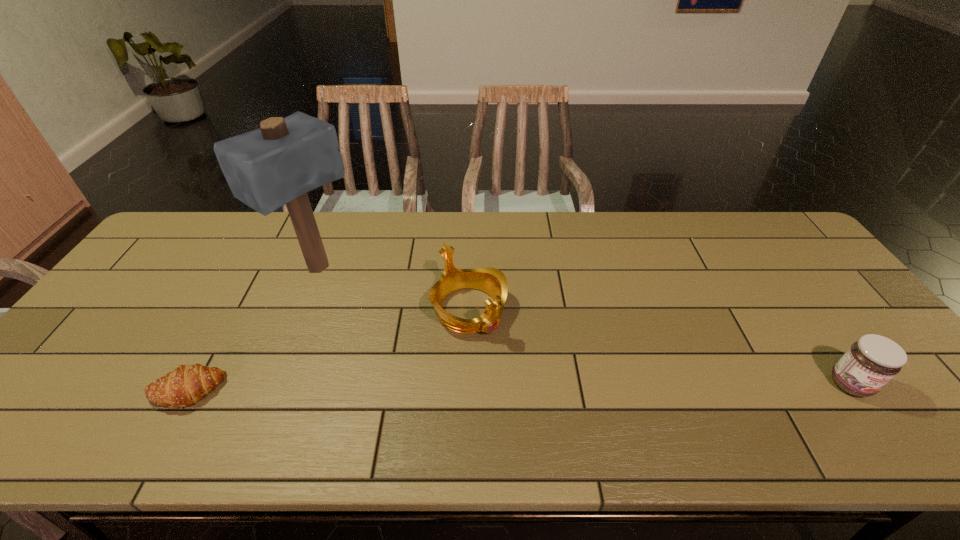
Image resolution: width=960 pixels, height=540 pixels. Identify the location of free space between the jam and the tiara. (660, 347).

I want to click on vacant space that is in between the mallet and the tiara, so click(394, 289).

At what (x,y) coordinates should I click in order to perform the action: click on free space between the second object from right to left and the crescent roll. Please return your answer as a coordinate pair (x, y). The image size is (960, 540). Looking at the image, I should click on (327, 350).

You are a GUI agent. You are given a task and a screenshot of the screen. Output one action in this format:
    pyautogui.click(x=<x>, y=<y>)
    Task: Click on the vacant region between the mallet and the shortest object
    The width and height of the screenshot is (960, 540).
    Given the screenshot: What is the action you would take?
    pyautogui.click(x=252, y=330)

The width and height of the screenshot is (960, 540). I want to click on unoccupied area between the jam and the mallet, so click(x=585, y=326).

Find the location of `free spot between the shortest object and the tallest object`. free spot between the shortest object and the tallest object is located at coordinates (252, 330).

The image size is (960, 540). In order to click on blank region between the crescent roll and the mallet in this screenshot , I will do `click(252, 330)`.

Where is `vacant area that lies between the shortest object and the mallet`? vacant area that lies between the shortest object and the mallet is located at coordinates pos(252,330).

The height and width of the screenshot is (540, 960). What are the coordinates of `vacant space that's between the tallest object and the shortest object` in the screenshot? It's located at (252, 330).

What are the coordinates of `free space between the rightmost object and the tallest object` in the screenshot? It's located at (585, 326).